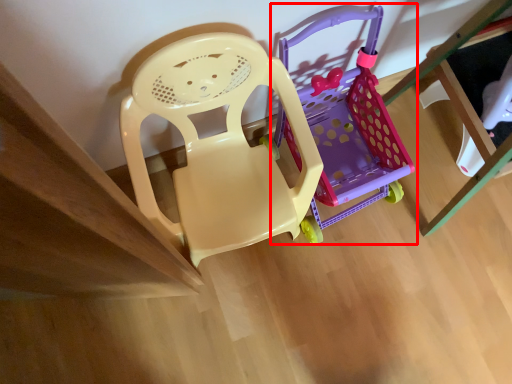
Question: From the image's perspective, where is toy (annotated by the red box) located in relation to chair in the image?

Choices:
 (A) below
 (B) above

Answer: (B)